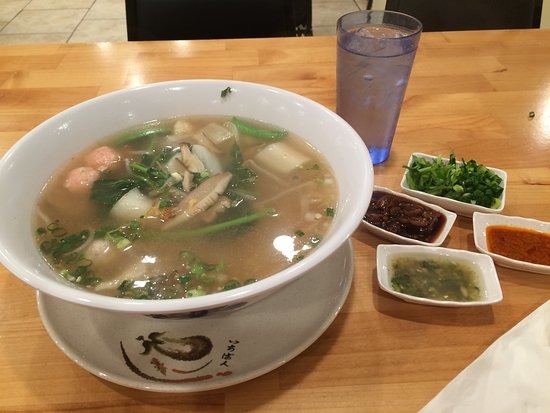
Where is `wooden tabletop`? wooden tabletop is located at coordinates (412, 345).